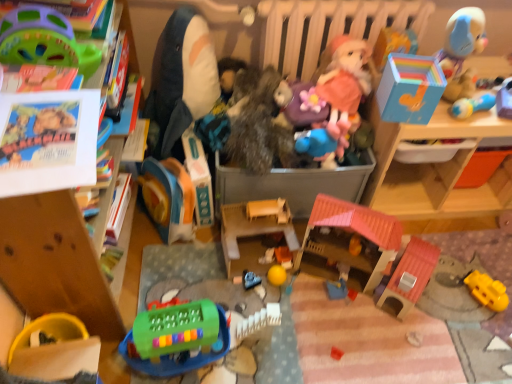
Where is `vacant region in front of smooth blue car at center, arranged as the sixth toy when viewed from the left`? This screenshot has height=384, width=512. vacant region in front of smooth blue car at center, arranged as the sixth toy when viewed from the left is located at coordinates (248, 322).